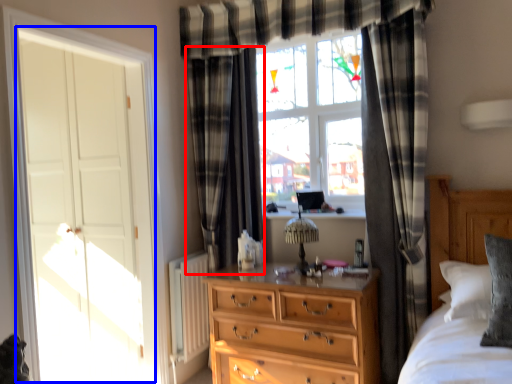
Question: Among these objects, which one is farthest to the camera, curtain (highlighted by a red box) or screen door (highlighted by a blue box)?

Choices:
 (A) curtain
 (B) screen door

Answer: (A)